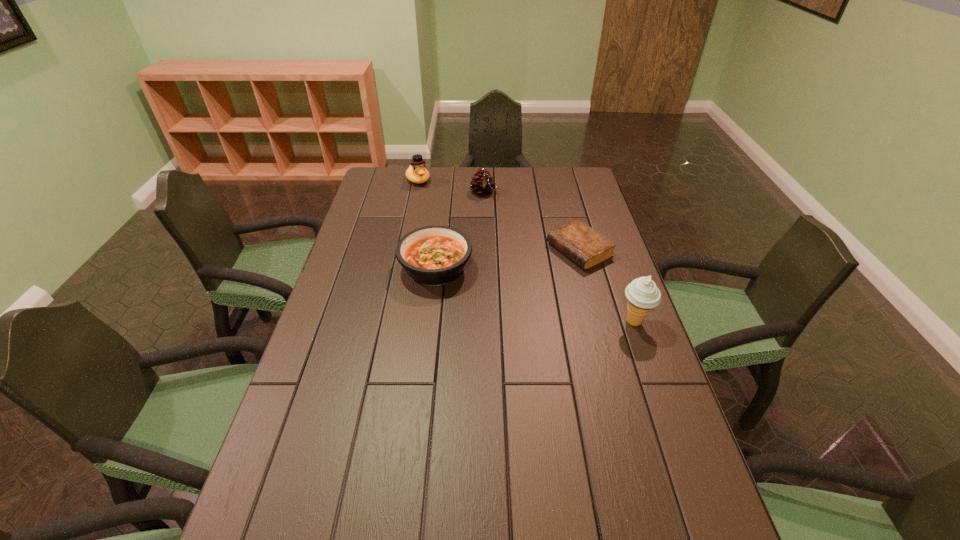
Find the location of `free space that satisfies the following two spatial constraints: 1. on the back side of the shortest object; 2. on the left side of the fourth tallest object`. free space that satisfies the following two spatial constraints: 1. on the back side of the shortest object; 2. on the left side of the fourth tallest object is located at coordinates (438, 250).